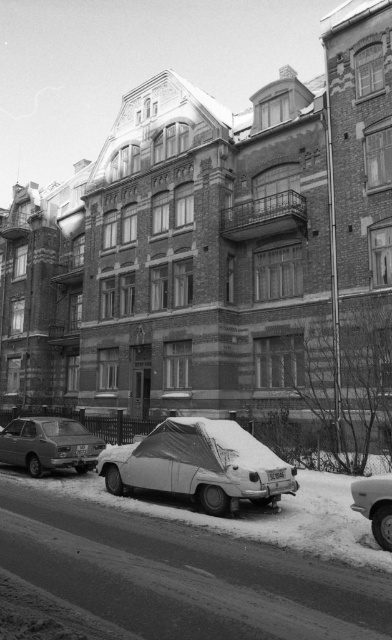
Question: Which of the following is the closest to the observer?

Choices:
 (A) (359, 484)
 (B) (116, 458)
 (C) (30, 467)

Answer: (A)

Question: Is snow-covered car at center below snow-covered car at lower right?

Choices:
 (A) yes
 (B) no

Answer: (A)

Question: Which of the following is the farthest from the observer?

Choices:
 (A) snow-covered car at center
 (B) matte silver sedan at lower left

Answer: (B)

Question: Is matte silver sedan at lower left thinner than snow-covered car at lower right?

Choices:
 (A) no
 (B) yes

Answer: (A)

Question: Does snow-covered car at center lie in front of matte silver sedan at lower left?

Choices:
 (A) yes
 (B) no

Answer: (A)

Question: Which of the following is the farthest from the observer?

Choices:
 (A) snow-covered car at lower right
 (B) matte silver sedan at lower left
 (C) snow-covered car at center

Answer: (B)